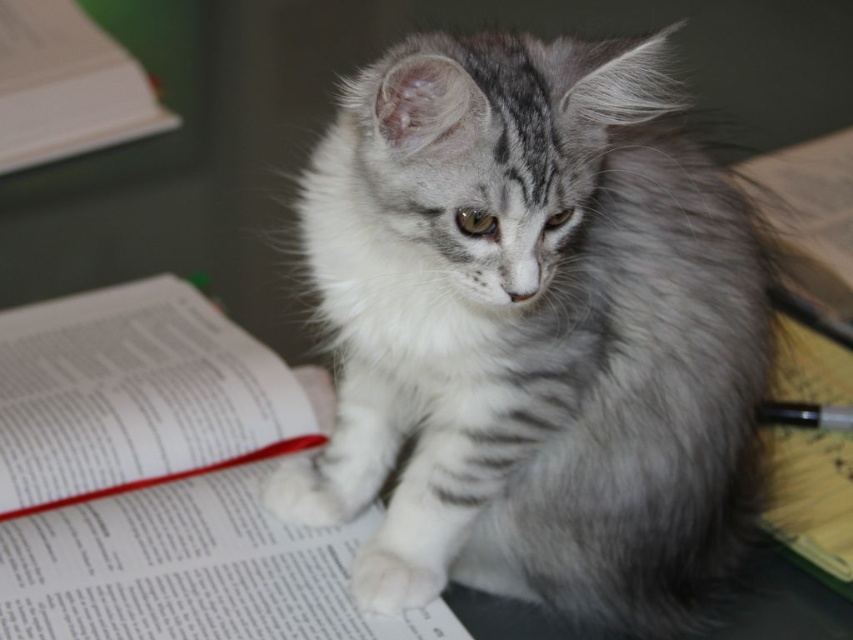
Consider the image. Is white paper book at center closer to the viewer compared to yellow paper notebook at lower right?

Yes, white paper book at center is closer to the viewer.

Is point (78, 310) positioned behind point (813, 566)?

Yes, point (78, 310) is farther from viewer.

Find the location of `white paper book at center`. white paper book at center is located at coordinates [164, 481].

What do you see at coordinates (532, 332) in the screenshot? I see `fuzzy gray cat at center` at bounding box center [532, 332].

I want to click on fuzzy gray cat at center, so click(532, 332).

Is fuzzy gray cat at center above yellow paper notebook at lower right?

Indeed, fuzzy gray cat at center is positioned over yellow paper notebook at lower right.

Which is more to the left, fuzzy gray cat at center or yellow paper notebook at lower right?

Positioned to the left is fuzzy gray cat at center.

Is point (440, 476) positioned behind point (838, 452)?

That is False.

Locate an element on the screen. This screenshot has width=853, height=640. fuzzy gray cat at center is located at coordinates (532, 332).